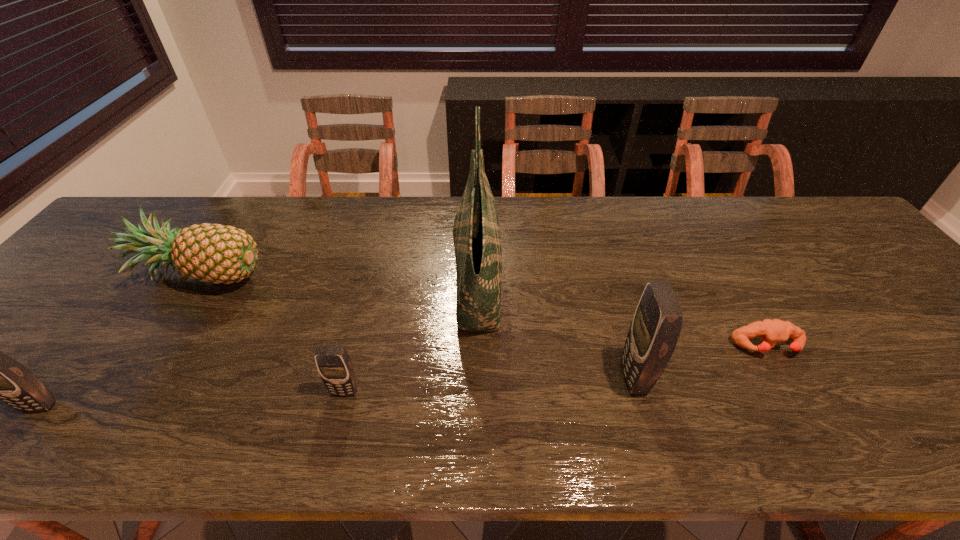
Identify the location of the second shortest cellular telephone. The width and height of the screenshot is (960, 540). [x=0, y=377].

The image size is (960, 540). I want to click on the third object from left to right, so click(334, 365).

Locate an element on the screen. The image size is (960, 540). the second shortest object is located at coordinates (334, 365).

The height and width of the screenshot is (540, 960). What are the coordinates of `the tallest cellular telephone` in the screenshot? It's located at (658, 320).

The height and width of the screenshot is (540, 960). Identify the location of the fifth shortest object. (658, 320).

Image resolution: width=960 pixels, height=540 pixels. Identify the location of pineapple. (214, 253).

The width and height of the screenshot is (960, 540). In order to click on the fourth object from left to right in this screenshot , I will do click(x=477, y=242).

The width and height of the screenshot is (960, 540). What are the coordinates of `the tallest object` in the screenshot? It's located at (477, 242).

The height and width of the screenshot is (540, 960). In order to click on the rightmost object in this screenshot , I will do `click(770, 331)`.

Where is `the shortest object`? the shortest object is located at coordinates (770, 331).